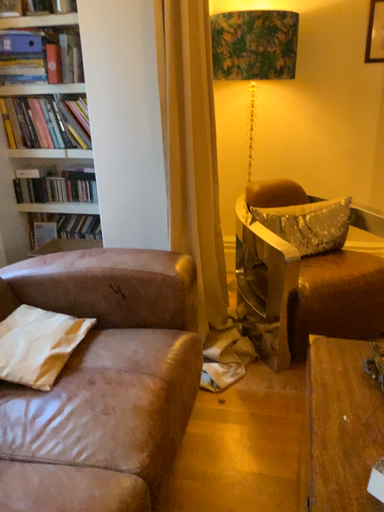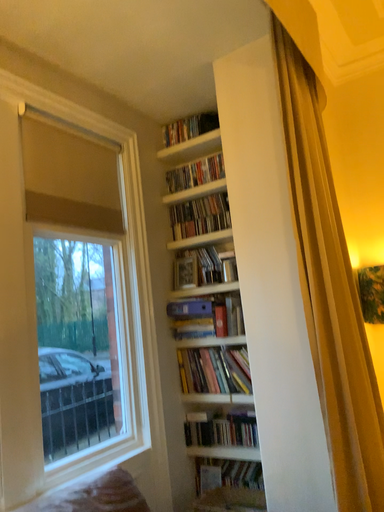
Question: Which way did the camera rotate in the video?

Choices:
 (A) rotated right
 (B) rotated left

Answer: (B)